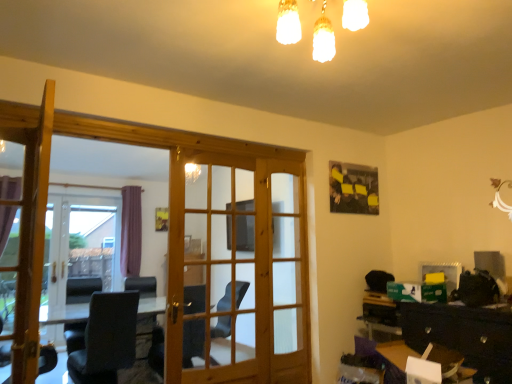
This screenshot has width=512, height=384. Identify the location of free space above wooden door at center, which is counted as the 1th door, starting from the back (from a real-world perspective). point(220,144).